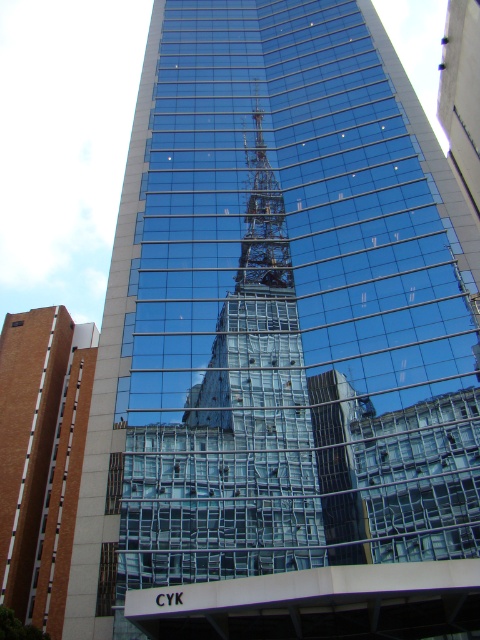
Is point (76, 376) closer to viewer compared to point (284, 280)?

No, it is behind (284, 280).

Between brown brick building at lower left and metallic lattice structure at center, which one appears on the right side from the viewer's perspective?

metallic lattice structure at center is more to the right.

Between point (25, 588) and point (252, 182), which one is positioned in front?

Positioned in front is point (252, 182).

Identify the location of brown brick building at lower left. The image size is (480, 640). [41, 456].